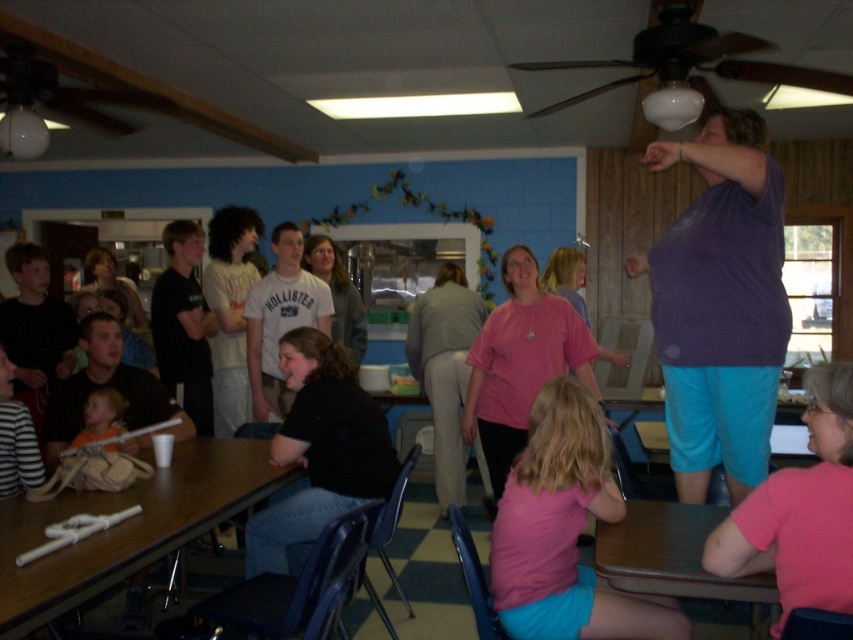
You are a guest at the event and want to place a small gift on the brown wood table at lower right. However, there is a pink fabric shirt at lower right already on it. Can you place your gift on the table without moving the shirt?

The pink fabric shirt at lower right is positioned over brown wood table at lower right, so there might not be enough space to place the gift without moving the shirt.

Looking at this image, you are at the community event and want to locate the pink matte shirt at lower center. Which direction should you look relative to the pink fabric shirt at lower right?

The pink matte shirt at lower center is to the left of the pink fabric shirt at lower right, so you should look to the left of the pink fabric shirt at lower right to find it.